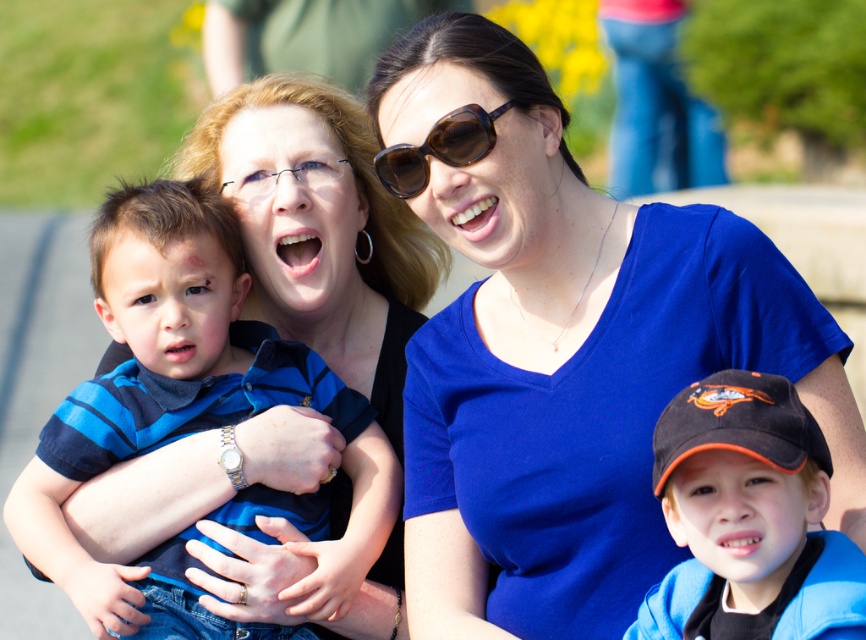
Based on the scene description, where is the blue matte shirt at center located in terms of coordinates?

The blue matte shirt at center is located at coordinates point (563, 348).

You are a photographer trying to capture a candid shot of the brown matte sunglasses at upper center without including the blue striped shirt at left in the frame. Based on their positions, can you position yourself in a way to achieve this?

The brown matte sunglasses at upper center is behind the blue striped shirt at left, so positioning yourself behind the blue striped shirt at left would allow you to capture the brown matte sunglasses at upper center without the blue striped shirt at left blocking the view.